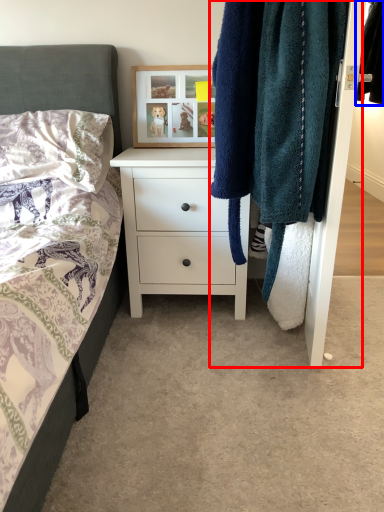
Question: Which object appears closest to the camera in this image, closet (highlighted by a red box) or clothing (highlighted by a blue box)?

Choices:
 (A) closet
 (B) clothing

Answer: (A)